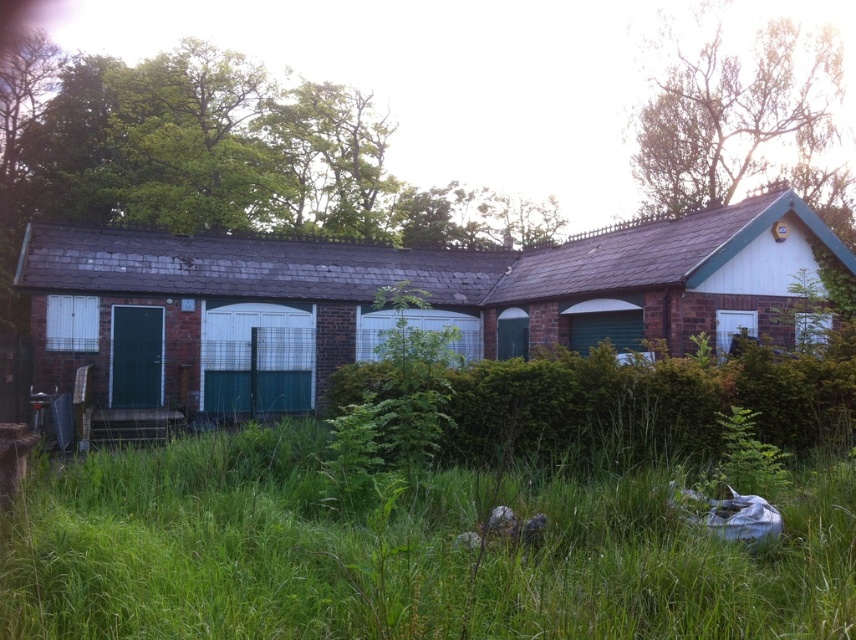
Question: Which point is closer to the camera?

Choices:
 (A) brown brick garage at center
 (B) brick wall garage at center

Answer: (A)

Question: Is green grass at lower center closer to the viewer compared to brown brick garage at center?

Choices:
 (A) no
 (B) yes

Answer: (B)

Question: Among these points, which one is nearest to the camera?

Choices:
 (A) (168, 596)
 (B) (507, 333)
 (C) (688, 305)

Answer: (A)

Question: Does green grass at lower center have a smaller size compared to brown brick garage at center?

Choices:
 (A) yes
 (B) no

Answer: (A)

Question: In this image, where is green grass at lower center located relative to brick wall garage at center?

Choices:
 (A) below
 (B) above

Answer: (A)

Question: Among these objects, which one is farthest from the camera?

Choices:
 (A) green grass at lower center
 (B) brown brick garage at center
 (C) brick wall garage at center

Answer: (C)